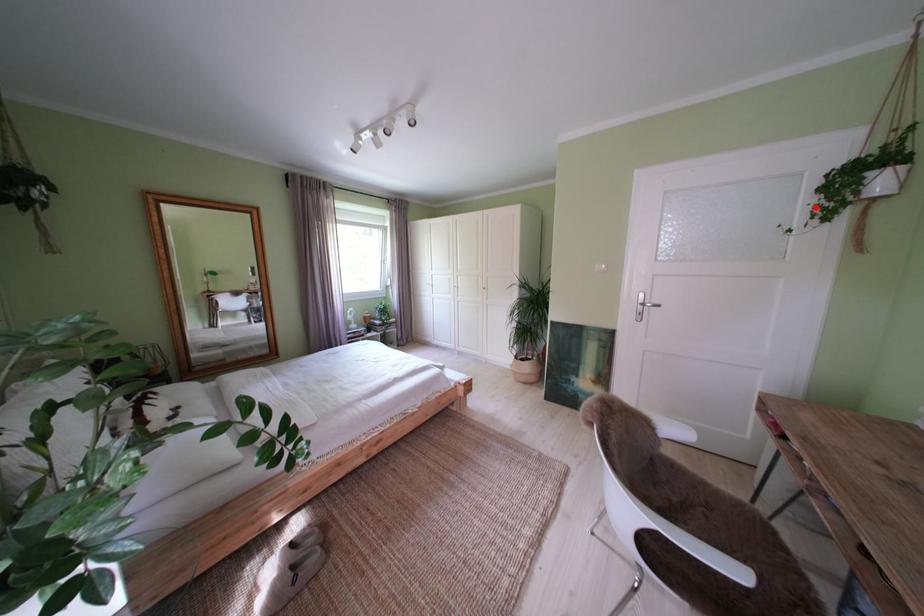
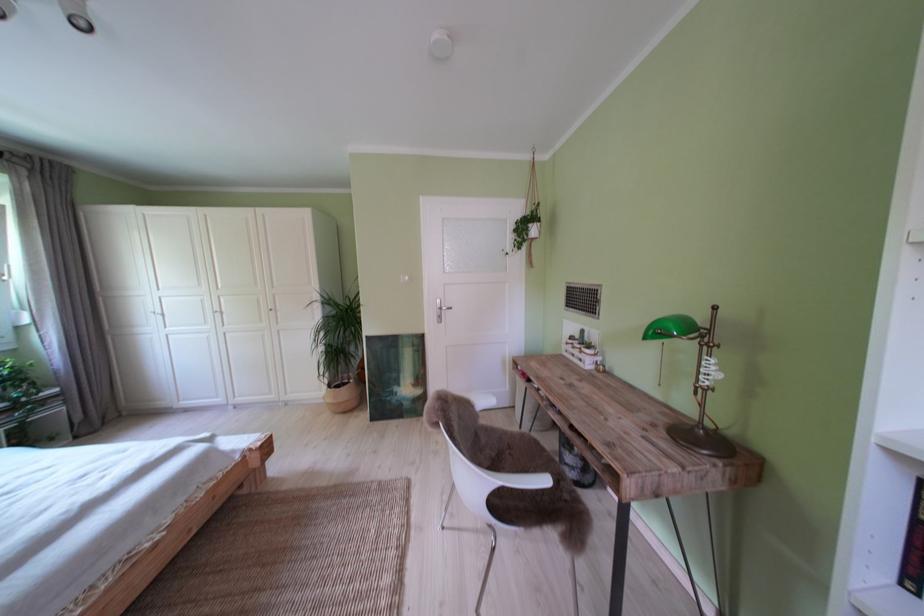
Question: I am providing you with two images of the same scene from different viewpoints. Image1 has a red point marked. In image2, the corresponding 3D location appears at what relative position? Reply with the corresponding letter.

Choices:
 (A) Closer
 (B) Farther

Answer: (A)